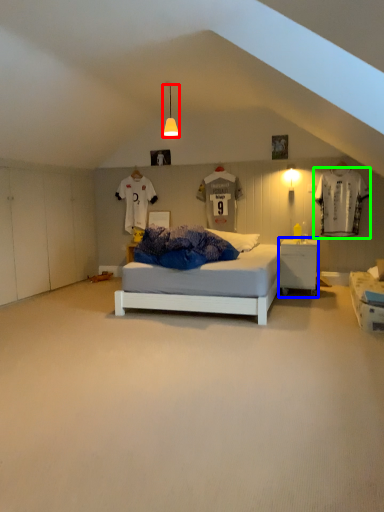
Question: Which is farther away from light fixture (highlighted by a red box)? nightstand (highlighted by a blue box) or laundry (highlighted by a green box)?

Choices:
 (A) nightstand
 (B) laundry

Answer: (B)